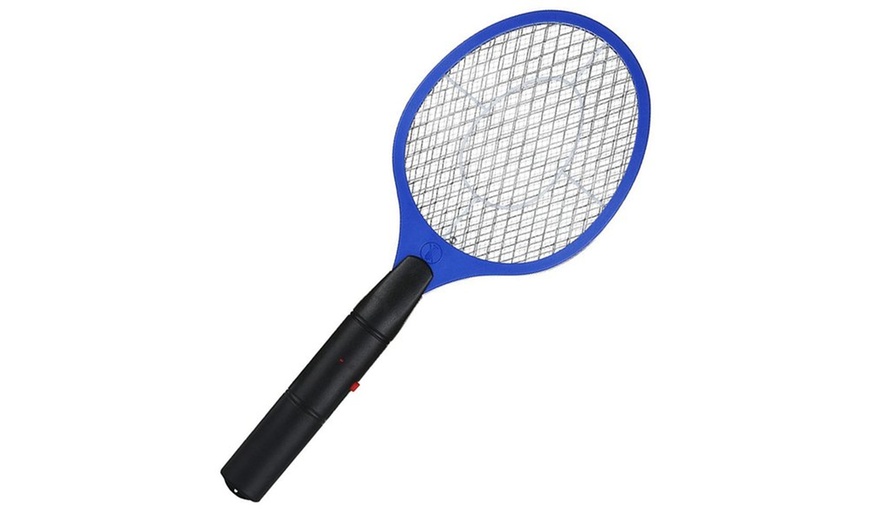
The width and height of the screenshot is (870, 524). I want to click on small hole for hanging up on a hook, so click(x=236, y=489).